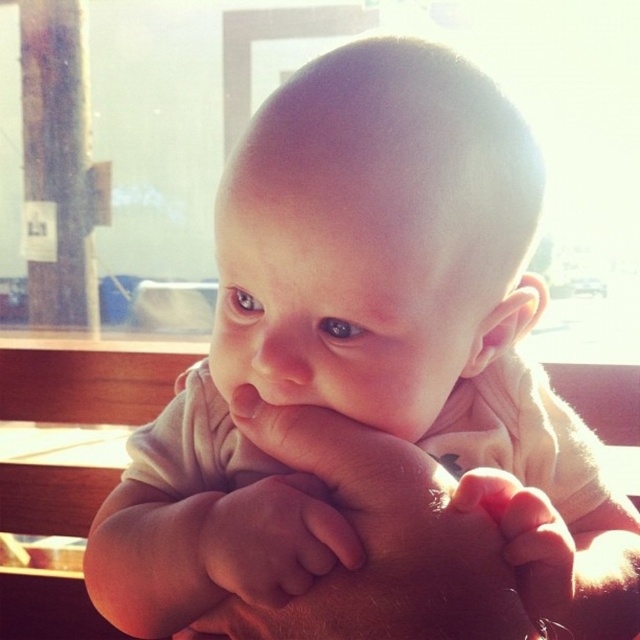
Which of these two, pink soft skin at center or soft skin hand at lower right, stands shorter?

pink soft skin at center

Is point (241, 548) positioned behind point (544, 504)?

Yes, it is.

Where is `pink soft skin at center`? The width and height of the screenshot is (640, 640). pink soft skin at center is located at coordinates (273, 540).